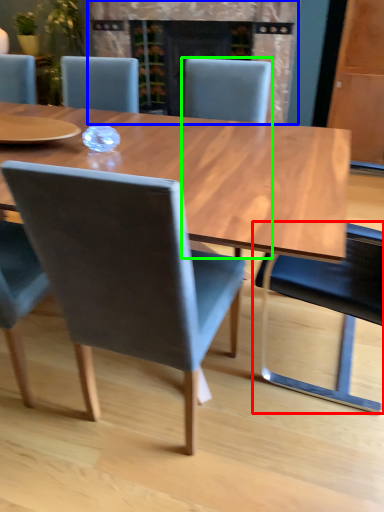
Question: Which object is the farthest from chair (highlighted by a red box)? Choose among these: fireplace (highlighted by a blue box) or chair (highlighted by a green box).

Choices:
 (A) fireplace
 (B) chair

Answer: (A)